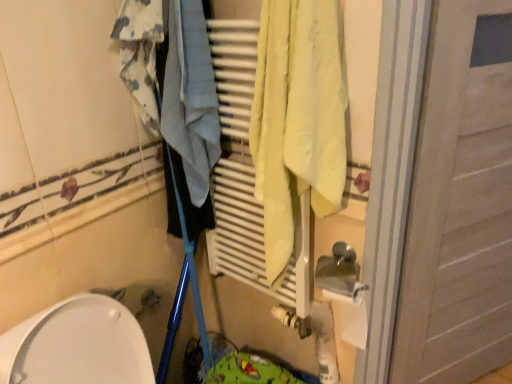
Image resolution: width=512 pixels, height=384 pixels. In order to click on blue printed fabric at upper left in this screenshot , I will do `click(140, 54)`.

Describe the element at coordinates (140, 54) in the screenshot. I see `blue printed fabric at upper left` at that location.

The height and width of the screenshot is (384, 512). Describe the element at coordinates (460, 203) in the screenshot. I see `white wooden door at right` at that location.

Find the location of `white wooden door at right`. white wooden door at right is located at coordinates tap(460, 203).

What are the coordinates of `blue printed fabric at upper left` in the screenshot? It's located at 140,54.

Is blue printed fabric at upper left to the left or to the right of white wooden door at right in the image?

blue printed fabric at upper left is positioned on white wooden door at right's left side.

Is blue printed fabric at upper left in front of white wooden door at right?

No, it is not.

Is point (152, 65) behind point (455, 66)?

Yes, point (152, 65) is farther from viewer.

From the image's perspective, who appears lower, blue printed fabric at upper left or white wooden door at right?

white wooden door at right appears lower in the image.

From a real-world perspective, is blue printed fabric at upper left beneath white wooden door at right?

Incorrect, from a real-world perspective, blue printed fabric at upper left is higher than white wooden door at right.

Is blue printed fabric at upper left thinner than white wooden door at right?

No, blue printed fabric at upper left is not thinner than white wooden door at right.

Looking at this image, between blue printed fabric at upper left and white wooden door at right, which one has more height?

With more height is white wooden door at right.

Can you confirm if blue printed fabric at upper left is bigger than white wooden door at right?

No.

Is blue printed fabric at upper left inside or outside of white wooden door at right?

blue printed fabric at upper left is not inside white wooden door at right, it's outside.

Would you say blue printed fabric at upper left is a long distance from white wooden door at right?

blue printed fabric at upper left is actually quite close to white wooden door at right.

Is blue printed fabric at upper left facing towards white wooden door at right?

No, blue printed fabric at upper left is not facing towards white wooden door at right.

How far apart are blue printed fabric at upper left and white wooden door at right?

35.98 inches.

Identify the location of door located on the right of blue printed fabric at upper left. (460, 203).

Between white wooden door at right and blue printed fabric at upper left, which one appears on the left side from the viewer's perspective?

blue printed fabric at upper left is more to the left.

Relative to blue printed fabric at upper left, is white wooden door at right in front or behind?

In the image, white wooden door at right appears in front of blue printed fabric at upper left.

Which is closer, [431,117] or [148,54]?

The point [431,117] is more forward.

Based on the photo, from the image's perspective, which is below, white wooden door at right or blue printed fabric at upper left?

white wooden door at right, from the image's perspective.

From a real-world perspective, relative to blue printed fabric at upper left, is white wooden door at right vertically above or below?

From a real-world perspective, white wooden door at right is physically below blue printed fabric at upper left.

Is white wooden door at right wider or thinner than blue printed fabric at upper left?

white wooden door at right is thinner than blue printed fabric at upper left.

Considering the sizes of objects white wooden door at right and blue printed fabric at upper left in the image provided, who is taller, white wooden door at right or blue printed fabric at upper left?

Standing taller between the two is white wooden door at right.

Which of these two, white wooden door at right or blue printed fabric at upper left, is bigger?

Bigger between the two is white wooden door at right.

Is blue printed fabric at upper left completely or partially inside white wooden door at right?

That's incorrect, blue printed fabric at upper left is not inside white wooden door at right.

Is white wooden door at right positioned far away from blue printed fabric at upper left?

No, white wooden door at right is not far away from blue printed fabric at upper left.

Is white wooden door at right oriented away from blue printed fabric at upper left?

That's not correct — white wooden door at right is not looking away from blue printed fabric at upper left.

How many degrees apart are the facing directions of white wooden door at right and blue printed fabric at upper left?

The angle between the facing direction of white wooden door at right and the facing direction of blue printed fabric at upper left is 62.5 degrees.

How far apart are white wooden door at right and blue printed fabric at upper left?

They are 35.98 inches apart.

I want to click on door on the right of blue printed fabric at upper left, so click(460, 203).

Identify the location of clothing lying on the left of white wooden door at right. This screenshot has width=512, height=384. (140, 54).

Locate an element on the screen. clothing located behind the white wooden door at right is located at coordinates (140, 54).